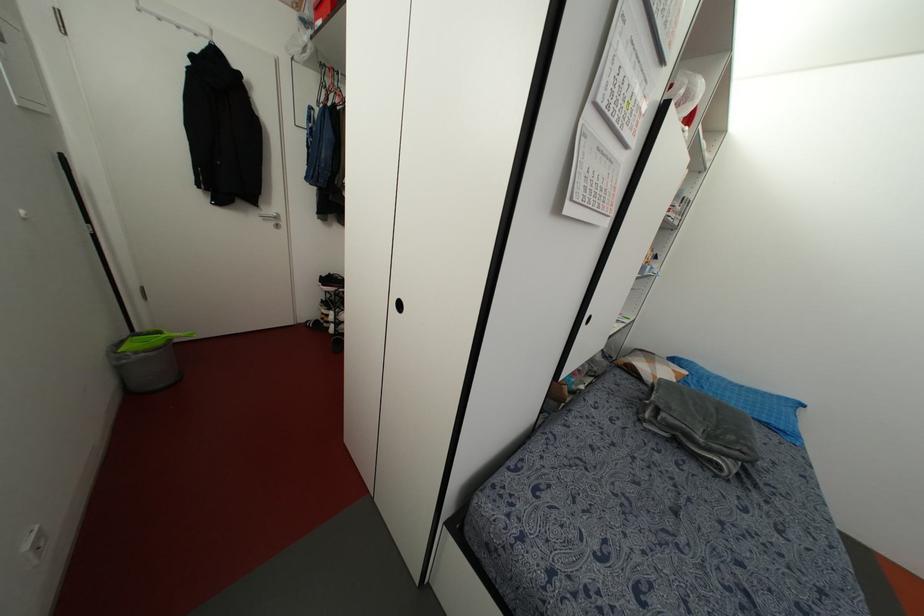
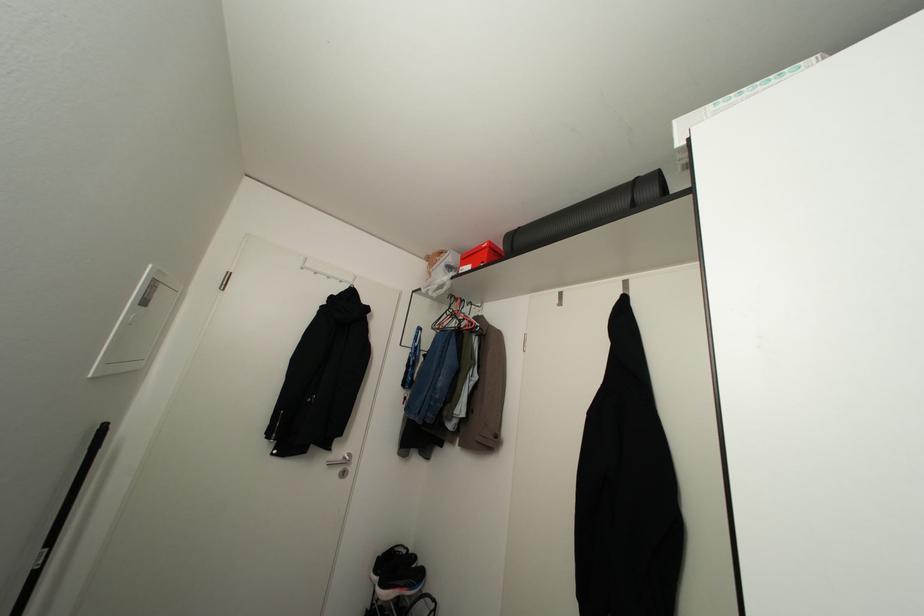
In the second image, find the point that corresponds to (x=322, y=63) in the first image.

(451, 294)